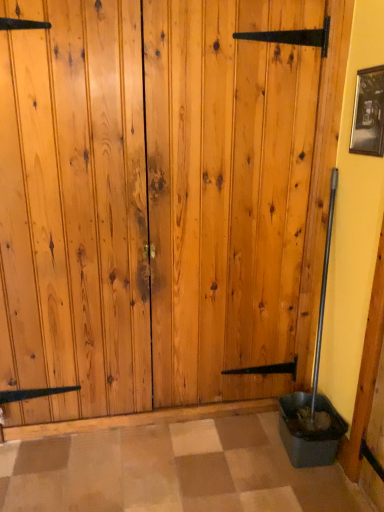
Image resolution: width=384 pixels, height=512 pixels. What are the coordinates of `wooden framed picture at upper right` in the screenshot? It's located at (368, 113).

Describe the element at coordinates (368, 113) in the screenshot. I see `wooden framed picture at upper right` at that location.

Where is `wooden framed picture at upper right`? wooden framed picture at upper right is located at coordinates (368, 113).